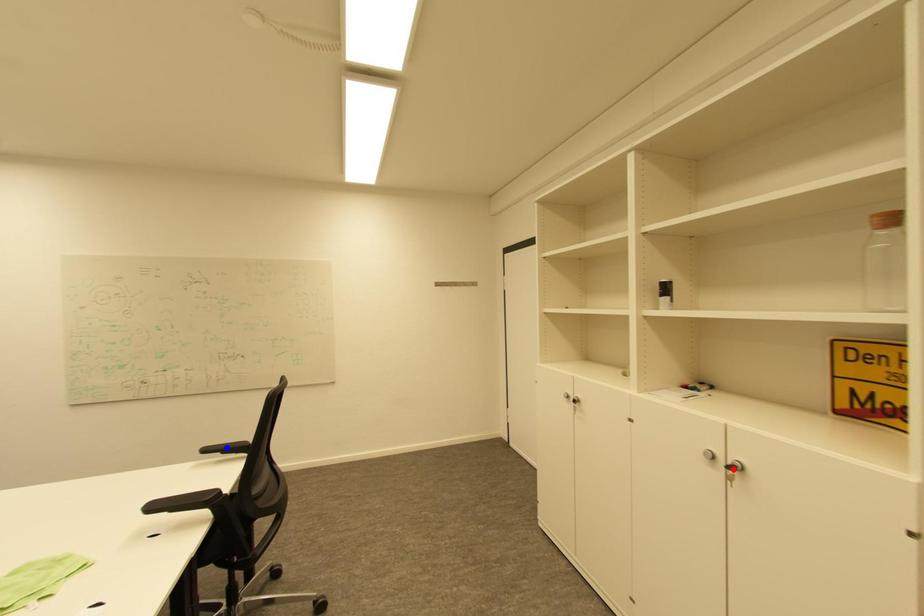
Question: Two points are marked on the image. Which point is closer to the camera?

Choices:
 (A) Blue point is closer.
 (B) Red point is closer.

Answer: (B)